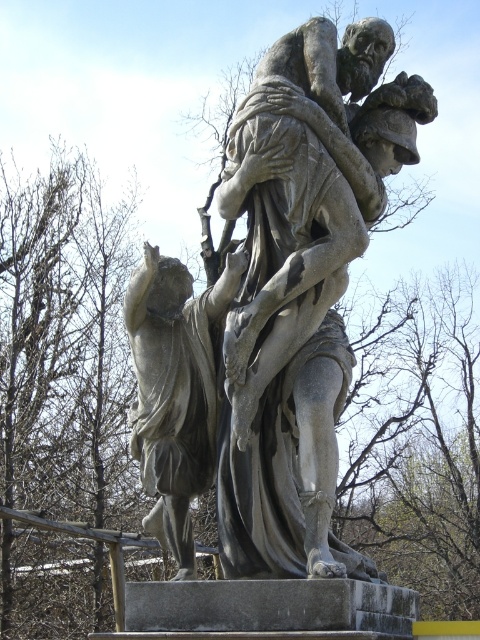
Does gray stone sculpture at center appear over matte gray statue at center?

Correct, gray stone sculpture at center is located above matte gray statue at center.

Is the position of gray stone sculpture at center less distant than that of matte gray statue at center?

Yes.

Which is in front, point (237, 387) or point (163, 353)?

Point (237, 387) is more forward.

I want to click on gray stone sculpture at center, so click(x=275, y=308).